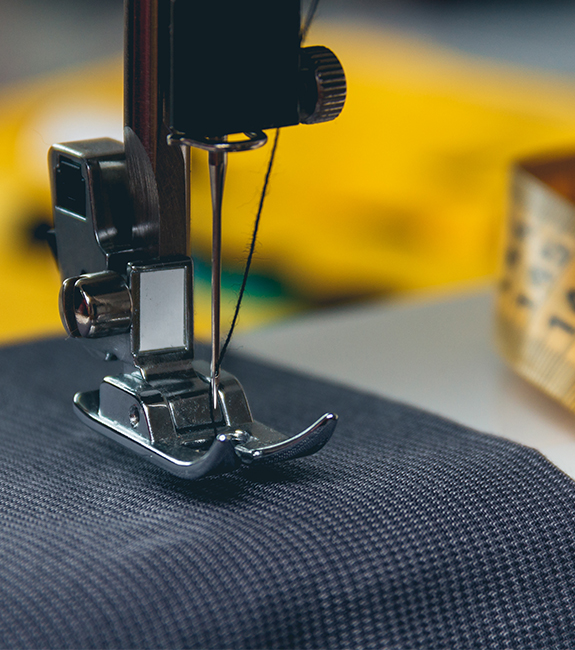
The width and height of the screenshot is (575, 650). In order to click on fabric in this screenshot , I will do `click(276, 545)`, `click(68, 484)`, `click(48, 366)`, `click(291, 390)`.